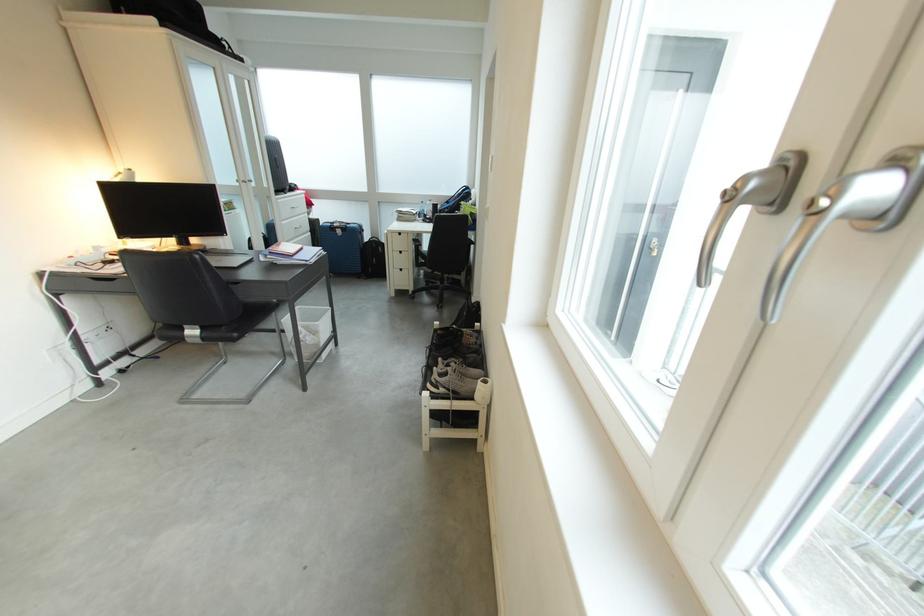
Where is `black laptop computer`? The width and height of the screenshot is (924, 616). black laptop computer is located at coordinates (163, 209).